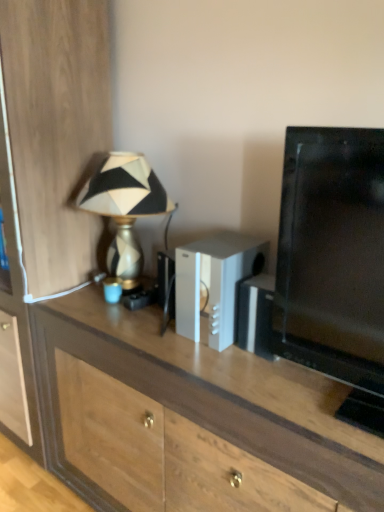
Where is `free space in front of silver metallic speaker at center`? The height and width of the screenshot is (512, 384). free space in front of silver metallic speaker at center is located at coordinates (213, 371).